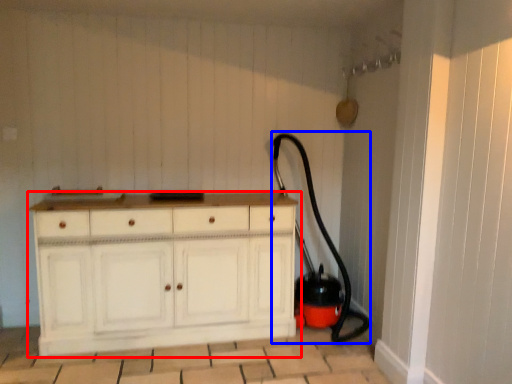
Question: Which of the following is the closest to the observer, chest of drawers (highlighted by a red box) or garden hose (highlighted by a blue box)?

Choices:
 (A) chest of drawers
 (B) garden hose

Answer: (A)